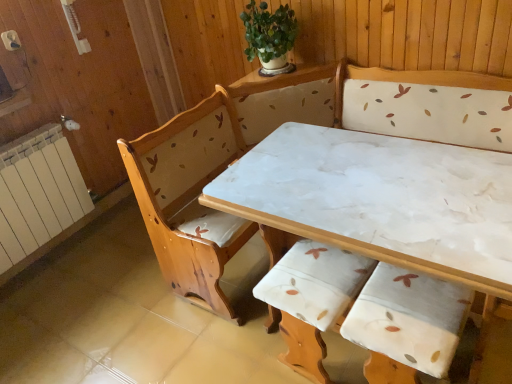
Where is `free space above white marble table at center (from a real-world perspective)`? free space above white marble table at center (from a real-world perspective) is located at coordinates (371, 187).